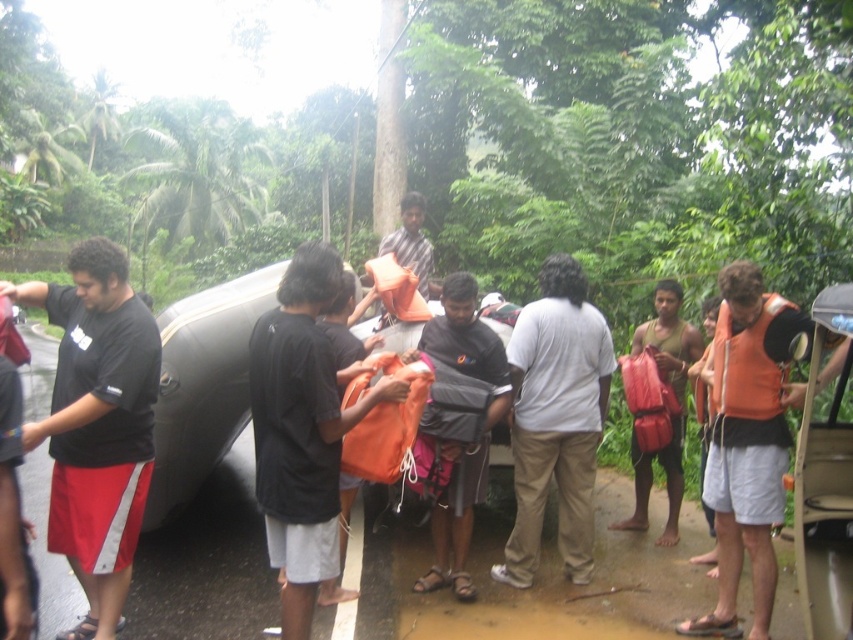
You are a photographer trying to capture a clear shot of the black fabric shirt at left and the orange fabric bag at center. Since you want to ensure both are visible in the frame, which object should you focus on first to account for their sizes?

The black fabric shirt at left is bigger than the orange fabric bag at center, so you should focus on the black fabric shirt at left first because it occupies more space in the frame.

Consider the image. You are standing at point [328,547] and want to move to the inflatable boat located at point [85,317]. Is the inflatable boat in front of or behind you?

The inflatable boat located at point [85,317] is behind you because point [85,317] is behind point [328,547].

You are a delivery robot with a 1.5 meter wide package. You need to move from the black fabric shirt at left to the dark gray fabric bag at center. Is there enough space between them for your package?

The distance between the black fabric shirt at left and the dark gray fabric bag at center is 1.94 meters. Since your package is 1.5 meters wide, there is sufficient space to move through the gap.